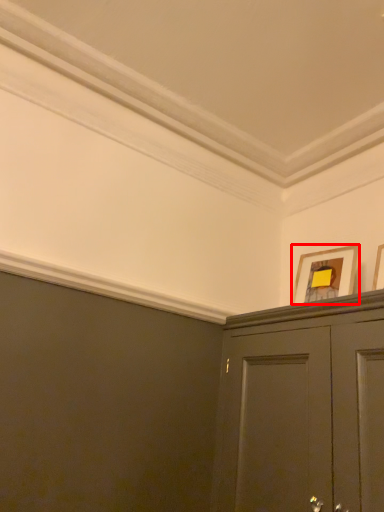
Question: From the image's perspective, what is the correct spatial relationship of picture frame (annotated by the red box) in relation to picture frame?

Choices:
 (A) below
 (B) above

Answer: (A)